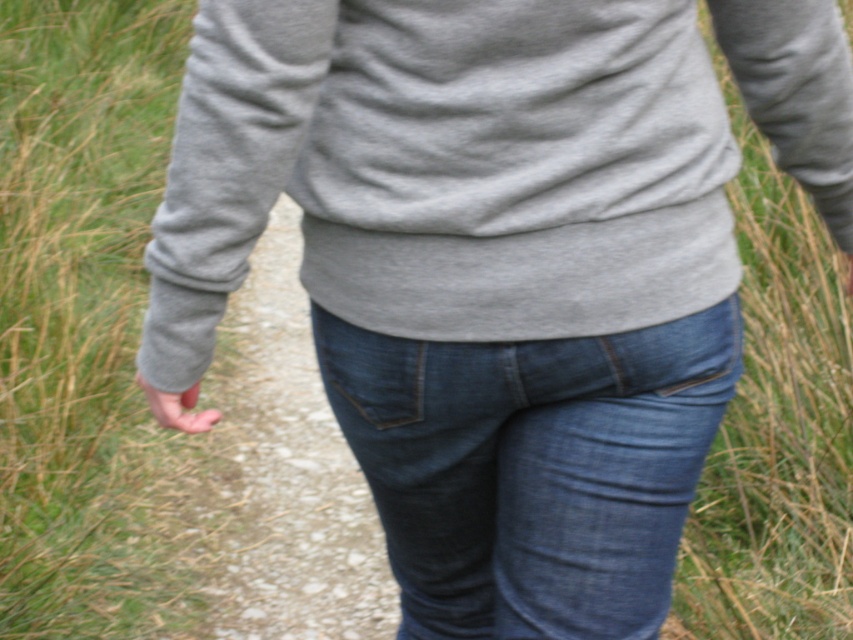
Question: Which object appears closest to the camera in this image?

Choices:
 (A) green grass at left
 (B) matte gray hand at lower left
 (C) matte pink skin at lower center
 (D) denim at center

Answer: (D)

Question: In this image, where is gray cotton sweatshirt at center located relative to green grass at left?

Choices:
 (A) above
 (B) below

Answer: (B)

Question: Among these points, which one is farthest from the camera?

Choices:
 (A) (386, 193)
 (B) (563, 632)
 (C) (846, 292)

Answer: (C)

Question: Estimate the real-world distances between objects in this image. Which object is farther from the matte pink skin at lower center?

Choices:
 (A) denim pants at lower center
 (B) green grass at left
 (C) matte gray hand at lower left
 (D) denim at center

Answer: (B)

Question: Does gray cotton sweatshirt at center have a lesser width compared to green grass at left?

Choices:
 (A) yes
 (B) no

Answer: (A)

Question: Does green grass at left have a lesser width compared to denim pants at lower center?

Choices:
 (A) yes
 (B) no

Answer: (B)